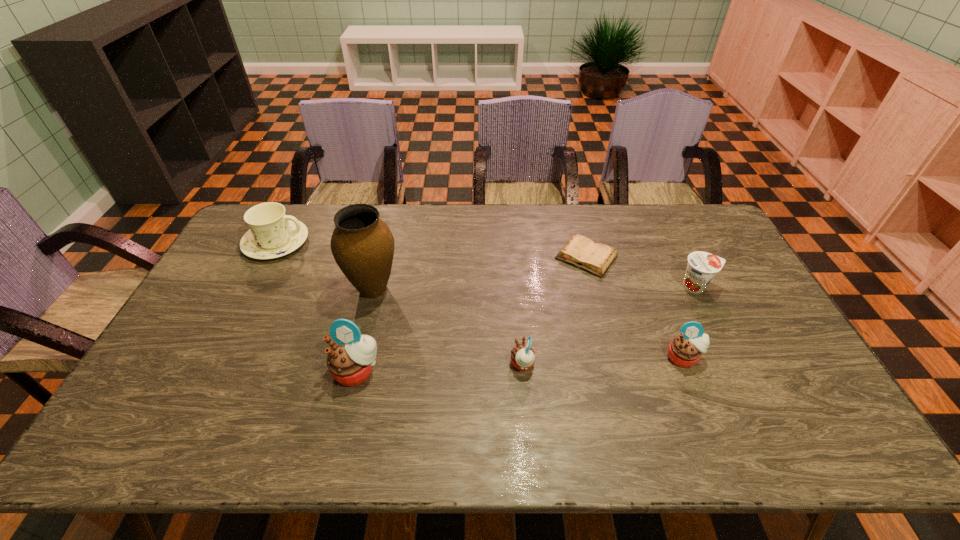
This screenshot has height=540, width=960. I want to click on vacant space at the far right corner of the desktop, so click(x=680, y=208).

The height and width of the screenshot is (540, 960). In the image, there is a desktop. What are the coordinates of `vacant space at the near right corner` in the screenshot? It's located at (774, 392).

The height and width of the screenshot is (540, 960). In order to click on free space between the diary and the leftmost muffin in this screenshot , I will do (x=471, y=314).

Where is `free space between the second tallest object and the yogurt`? This screenshot has height=540, width=960. free space between the second tallest object and the yogurt is located at coordinates (527, 329).

Where is `vacant point located between the leftmost object and the rightmost object`? This screenshot has height=540, width=960. vacant point located between the leftmost object and the rightmost object is located at coordinates (487, 265).

Locate an element on the screen. empty location between the second tallest object and the diary is located at coordinates (471, 314).

This screenshot has width=960, height=540. I want to click on vacant area that lies between the leftmost object and the diary, so point(431,250).

Find the location of a particular element. The height and width of the screenshot is (540, 960). vacant area between the urn and the tallest muffin is located at coordinates (365, 330).

The width and height of the screenshot is (960, 540). In order to click on unoccupied position between the diary and the second shortest muffin in this screenshot , I will do `click(635, 307)`.

You are a GUI agent. You are given a task and a screenshot of the screen. Output one action in this format:
    pyautogui.click(x=<x>, y=<y>)
    Task: Click on the free space between the chinaware and the yogurt
    Image resolution: width=960 pixels, height=540 pixels.
    Given the screenshot: What is the action you would take?
    tap(487, 265)